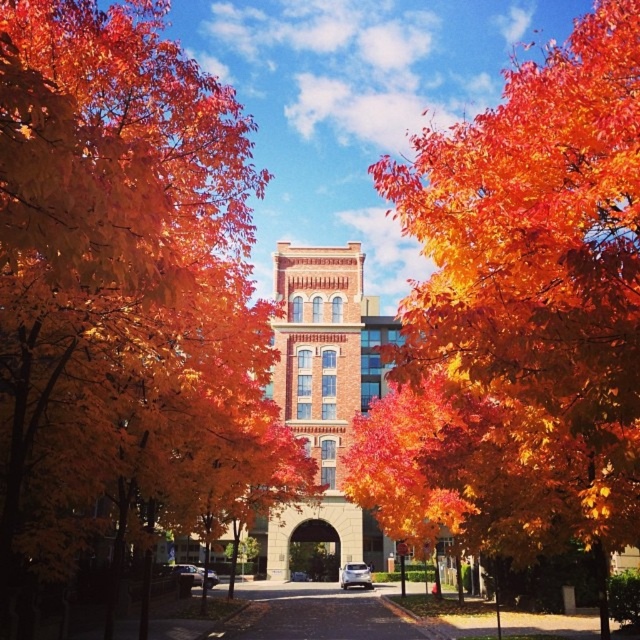
You are standing on the cobblestone pathway leading to the historic building. You see the shiny orange leaves at center and the orange leafy tree at center. Which object is closer to you?

The shiny orange leaves at center are closer to the viewer than the orange leafy tree at center.

You are standing at the point closest to the camera in the image. Which of the two points, point (237,131) or point (602,216), is farther away from you?

Point (237,131) is behind point (602,216), so it is farther away from you.